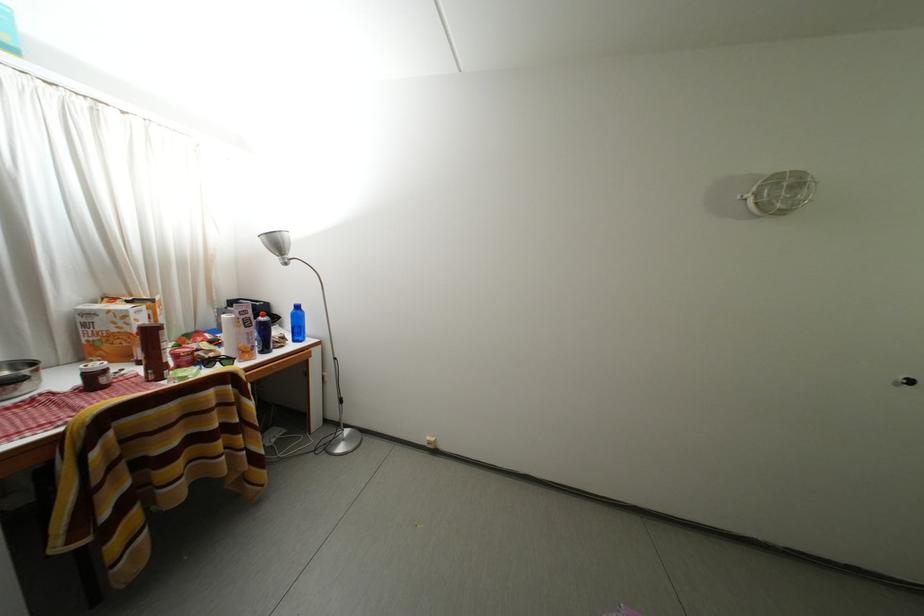
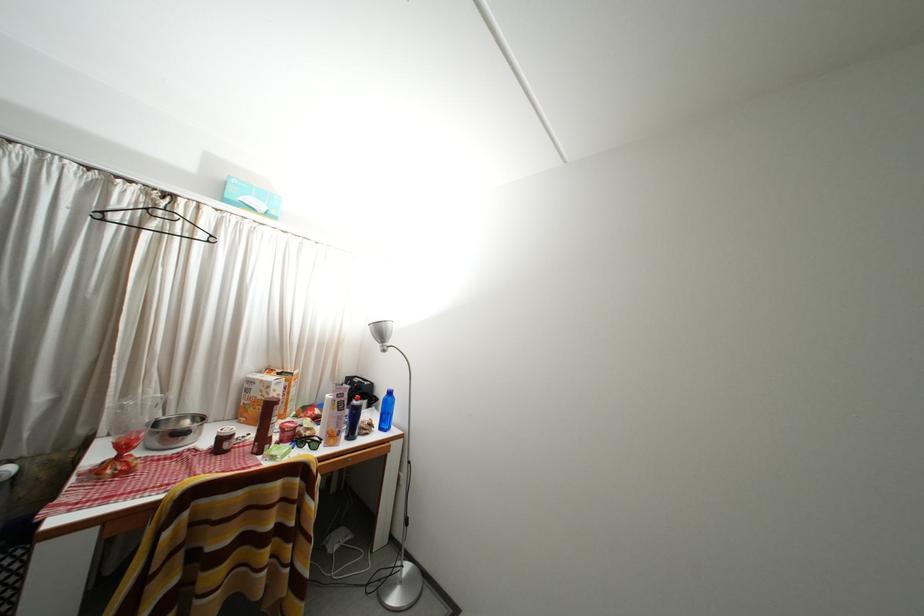
Find the pixel in the second image that matches point (101, 381) in the first image.

(229, 445)